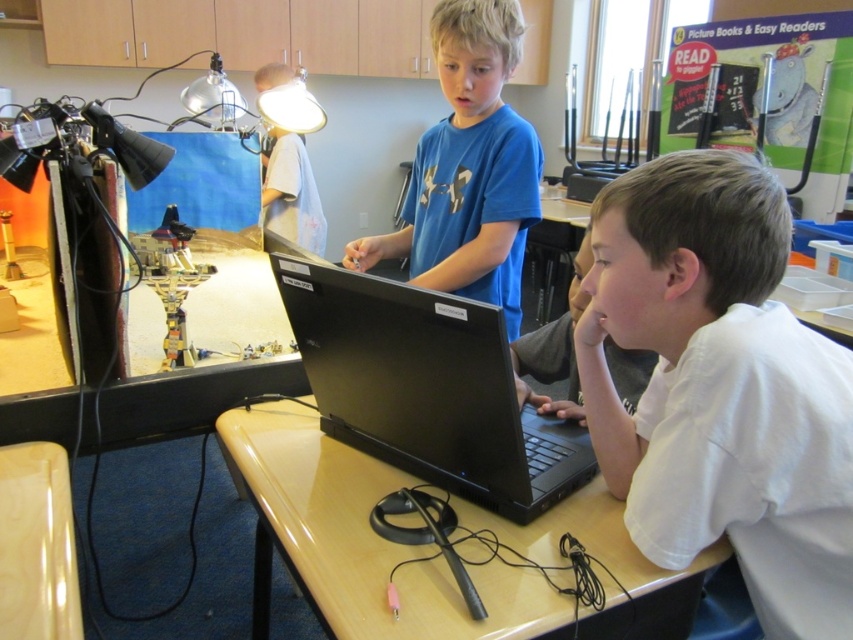
Based on the photo, you are standing at the point labeled as point (x=712, y=280) in the classroom. If you want to walk to the door located at the front of the room, which is 10 feet away from your current position, will you be able to reach it without moving past the table?

The distance between point (x=712, y=280) and the viewer is 32.73 inches. Since the door is 10 feet away, which is 120 inches, the point is much closer than the door. Therefore, you are currently at the point and need to walk 10 feet to reach the door, so you can reach it without moving past the table.

You are a teacher observing a classroom scene. You notice a point at coordinates (720, 388) on the image. What object in the scene is located at this point?

The white matte shirt at lower right is located at point (720, 388).

Based on the photo, you are a student trying to reach the glossy plastic table at center while standing next to the white matte shirt at lower right. Considering their heights, which object is taller?

The white matte shirt at lower right has a greater height compared to the glossy plastic table at center, so the white matte shirt at lower right is taller.